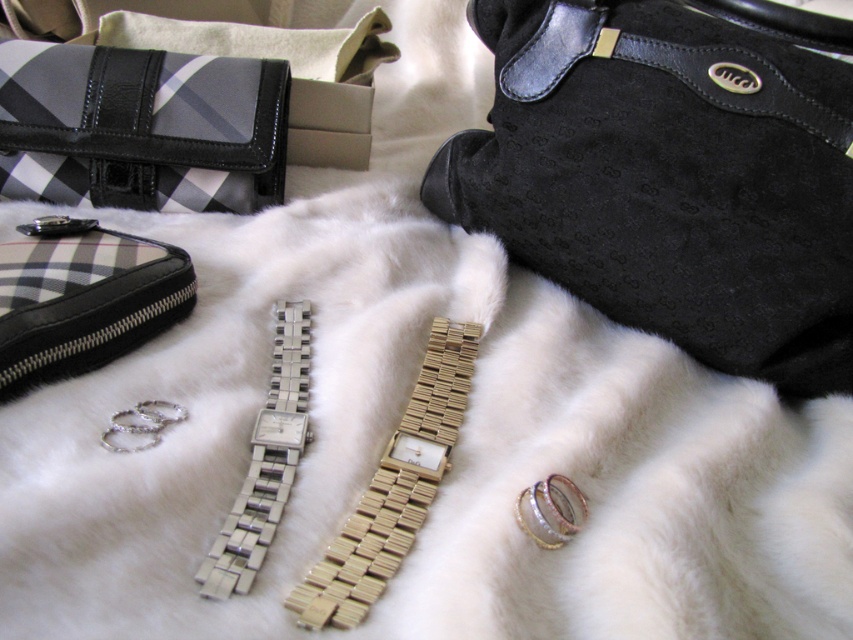
You are organizing a display of wallets and want to place the black leather wallet at upper left and the black checkered fabric wallet at upper left on a shelf. Which one should you place first if you want to arrange them from widest to narrowest?

The black leather wallet at upper left is wider than the black checkered fabric wallet at upper left, so you should place the black leather wallet at upper left first to arrange them from widest to narrowest.

You are a delivery person who needs to place a 50 centimeter long package between the black checkered fabric wallet at upper left and the suede leather strap at upper right. Can the package fit in the space between them?

The black checkered fabric wallet at upper left is 53.60 centimeters from the suede leather strap at upper right, so the 50 centimeter long package can fit in the space between them since it is shorter than the distance between the two items.

You are arranging items on a white fur surface and want to place the suede black handbag at upper right and the black checkered fabric wallet at upper left. According to the scene description, which item is positioned higher?

The suede black handbag at upper right is positioned higher than the black checkered fabric wallet at upper left.